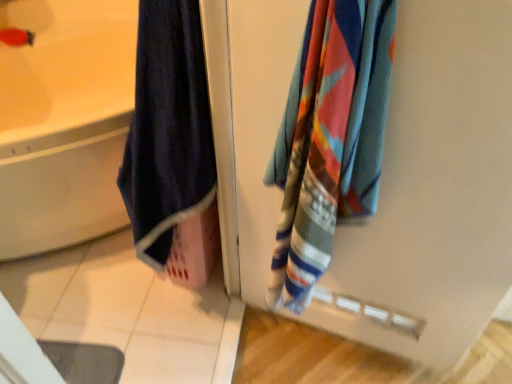
Describe the element at coordinates (64, 122) in the screenshot. I see `matte white bathtub at left` at that location.

This screenshot has height=384, width=512. Find the location of `matte white bathtub at left`. matte white bathtub at left is located at coordinates (64, 122).

In order to face matte white bathtub at left, should I rotate leftwards or rightwards?

Rotate your view left by about 12.775°.

The width and height of the screenshot is (512, 384). What do you see at coordinates (330, 139) in the screenshot?
I see `multicolored woven towel at right` at bounding box center [330, 139].

The image size is (512, 384). What are the coordinates of `multicolored woven towel at right` in the screenshot? It's located at (330, 139).

You are a GUI agent. You are given a task and a screenshot of the screen. Output one action in this format:
    pyautogui.click(x=<x>, y=<y>)
    Task: Click on the matte white bathtub at left
    Image resolution: width=512 pixels, height=384 pixels.
    Given the screenshot: What is the action you would take?
    pyautogui.click(x=64, y=122)

Is multicolored woven towel at right to the left of matte white bathtub at left from the viewer's perspective?

In fact, multicolored woven towel at right is to the right of matte white bathtub at left.

Which object is further away from the camera taking this photo, multicolored woven towel at right or matte white bathtub at left?

matte white bathtub at left is further away from the camera.

Which is in front, point (323, 148) or point (112, 168)?

Point (323, 148)

From the image's perspective, is multicolored woven towel at right positioned above or below matte white bathtub at left?

Based on their image positions, multicolored woven towel at right is located beneath matte white bathtub at left.

From a real-world perspective, who is located higher, multicolored woven towel at right or matte white bathtub at left?

In real-world perspective, multicolored woven towel at right is above.

Between multicolored woven towel at right and matte white bathtub at left, which one has smaller width?

With smaller width is multicolored woven towel at right.

Can you confirm if multicolored woven towel at right is shorter than matte white bathtub at left?

Incorrect, the height of multicolored woven towel at right does not fall short of that of matte white bathtub at left.

Can you confirm if multicolored woven towel at right is bigger than matte white bathtub at left?

Incorrect, multicolored woven towel at right is not larger than matte white bathtub at left.

Is matte white bathtub at left inside multicolored woven towel at right?

No, matte white bathtub at left is not surrounded by multicolored woven towel at right.

Is multicolored woven towel at right far away from matte white bathtub at left?

multicolored woven towel at right is positioned a significant distance from matte white bathtub at left.

From the picture: Could you tell me if multicolored woven towel at right is turned towards matte white bathtub at left?

No, multicolored woven towel at right is not facing towards matte white bathtub at left.

How many degrees apart are the facing directions of multicolored woven towel at right and matte white bathtub at left?

They differ by 76 degrees in their facing directions.

How distant is multicolored woven towel at right from matte white bathtub at left?

The distance of multicolored woven towel at right from matte white bathtub at left is 1.58 meters.

What are the coordinates of `bathtub below the multicolored woven towel at right (from a real-world perspective)` in the screenshot? It's located at (64, 122).

Considering the relative positions of matte white bathtub at left and multicolored woven towel at right in the image provided, is matte white bathtub at left to the left of multicolored woven towel at right from the viewer's perspective?

Correct, you'll find matte white bathtub at left to the left of multicolored woven towel at right.

Which is behind, matte white bathtub at left or multicolored woven towel at right?

matte white bathtub at left is behind.

Is point (26, 161) positioned behind point (367, 90)?

Yes.

Looking at this image, from the image's perspective, between matte white bathtub at left and multicolored woven towel at right, which one is located above?

matte white bathtub at left, from the image's perspective.

From a real-world perspective, which object rests below the other?

matte white bathtub at left is physically lower.

Between matte white bathtub at left and multicolored woven towel at right, which one has larger width?

With larger width is matte white bathtub at left.

Considering the sizes of objects matte white bathtub at left and multicolored woven towel at right in the image provided, who is taller, matte white bathtub at left or multicolored woven towel at right?

multicolored woven towel at right is taller.

Which of these two, matte white bathtub at left or multicolored woven towel at right, is smaller?

Smaller between the two is multicolored woven towel at right.

Looking at this image, would you say matte white bathtub at left contains multicolored woven towel at right?

No, multicolored woven towel at right is not surrounded by matte white bathtub at left.

Is matte white bathtub at left directly adjacent to multicolored woven towel at right?

No, matte white bathtub at left is not beside multicolored woven towel at right.

Could you tell me if matte white bathtub at left is facing multicolored woven towel at right?

No.

How many degrees apart are the facing directions of matte white bathtub at left and multicolored woven towel at right?

They differ by 76 degrees in their facing directions.

How much distance is there between matte white bathtub at left and multicolored woven towel at right?

1.58 meters.

Locate an element on the screen. bathtub that appears on the left of multicolored woven towel at right is located at coordinates (64, 122).

You are a GUI agent. You are given a task and a screenshot of the screen. Output one action in this format:
    pyautogui.click(x=<x>, y=<y>)
    Task: Click on the towel above the matte white bathtub at left (from a real-world perspective)
    The height and width of the screenshot is (384, 512).
    Given the screenshot: What is the action you would take?
    pyautogui.click(x=330, y=139)

This screenshot has width=512, height=384. Identify the location of bathtub behind the multicolored woven towel at right. (64, 122).